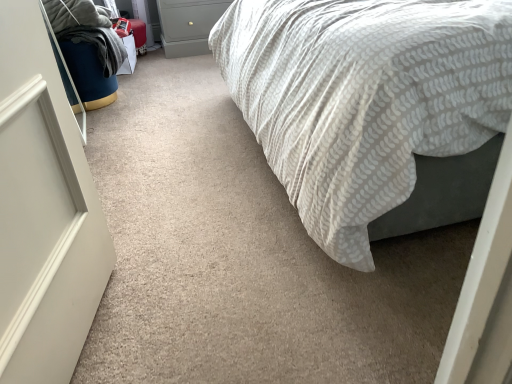
Question: Is white textured fabric bed at center not close to matte gray drawer at upper center?

Choices:
 (A) yes
 (B) no

Answer: (A)

Question: Does white textured fabric bed at center have a larger size compared to matte gray drawer at upper center?

Choices:
 (A) yes
 (B) no

Answer: (A)

Question: Is white textured fabric bed at center touching matte gray drawer at upper center?

Choices:
 (A) no
 (B) yes

Answer: (A)

Question: Is white textured fabric bed at center facing away from matte gray drawer at upper center?

Choices:
 (A) yes
 (B) no

Answer: (B)

Question: Is white textured fabric bed at center shorter than matte gray drawer at upper center?

Choices:
 (A) no
 (B) yes

Answer: (A)

Question: Based on their positions, is matte gray drawer at upper center located to the left or right of white textured fabric bed at center?

Choices:
 (A) left
 (B) right

Answer: (A)

Question: From the image's perspective, relative to white textured fabric bed at center, is matte gray drawer at upper center above or below?

Choices:
 (A) below
 (B) above

Answer: (B)

Question: Is matte gray drawer at upper center inside or outside of white textured fabric bed at center?

Choices:
 (A) outside
 (B) inside

Answer: (A)

Question: From their relative heights in the image, would you say matte gray drawer at upper center is taller or shorter than white textured fabric bed at center?

Choices:
 (A) short
 (B) tall

Answer: (A)

Question: Considering the relative positions of white textured fabric bed at center and matte gray drawer at upper center in the image provided, is white textured fabric bed at center to the left or to the right of matte gray drawer at upper center?

Choices:
 (A) right
 (B) left

Answer: (A)

Question: In terms of width, does white textured fabric bed at center look wider or thinner when compared to matte gray drawer at upper center?

Choices:
 (A) wide
 (B) thin

Answer: (A)

Question: From the image's perspective, is white textured fabric bed at center positioned above or below matte gray drawer at upper center?

Choices:
 (A) above
 (B) below

Answer: (B)

Question: Based on their sizes in the image, would you say white textured fabric bed at center is bigger or smaller than matte gray drawer at upper center?

Choices:
 (A) small
 (B) big

Answer: (B)

Question: From a real-world perspective, relative to white textured fabric bed at center, is velvet blue bean bag at left vertically above or below?

Choices:
 (A) below
 (B) above

Answer: (A)

Question: Considering the positions of velvet blue bean bag at left and white textured fabric bed at center in the image, is velvet blue bean bag at left taller or shorter than white textured fabric bed at center?

Choices:
 (A) short
 (B) tall

Answer: (A)